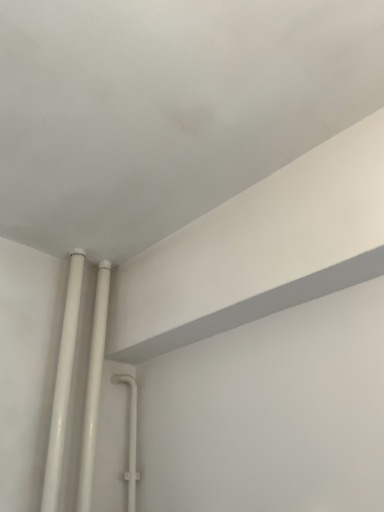
This screenshot has width=384, height=512. What do you see at coordinates (93, 387) in the screenshot?
I see `white glossy pipes at lower left, which ranks as the second pipe in left-to-right order` at bounding box center [93, 387].

Measure the distance between point (100, 380) and camera.

Point (100, 380) is 4.26 feet away from camera.

What is the approximate height of white glossy pipes at lower left, the first pipe when ordered from right to left?

It is 29.21 inches.

Identify the location of white glossy pipes at lower left, the first pipe when ordered from right to left. (93, 387).

How much space does white glossy pipes at lower left, the second pipe in the right-to-left sequence, occupy vertically?

The height of white glossy pipes at lower left, the second pipe in the right-to-left sequence, is 29.06 inches.

Describe the element at coordinates (63, 384) in the screenshot. I see `white glossy pipes at lower left, the second pipe in the right-to-left sequence` at that location.

At what (x,y) coordinates should I click in order to perform the action: click on white glossy pipes at lower left, the second pipe in the right-to-left sequence. Please return your answer as a coordinate pair (x, y). Looking at the image, I should click on (63, 384).

Identify the location of white glossy pipes at lower left, which ranks as the second pipe in left-to-right order. (93, 387).

Is white glossy pipes at lower left, arranged as the first pipe when viewed from the left, to the left of white glossy pipes at lower left, which ranks as the second pipe in left-to-right order, from the viewer's perspective?

Yes, white glossy pipes at lower left, arranged as the first pipe when viewed from the left, is to the left of white glossy pipes at lower left, which ranks as the second pipe in left-to-right order.

Considering their positions, is white glossy pipes at lower left, arranged as the first pipe when viewed from the left, located in front of or behind white glossy pipes at lower left, the first pipe when ordered from right to left?

In the image, white glossy pipes at lower left, arranged as the first pipe when viewed from the left, appears in front of white glossy pipes at lower left, the first pipe when ordered from right to left.

Which is farther from the camera, (76, 290) or (103, 271)?

Point (103, 271)

From the image's perspective, relative to white glossy pipes at lower left, the first pipe when ordered from right to left, is white glossy pipes at lower left, the second pipe in the right-to-left sequence, above or below?

From the image's perspective, white glossy pipes at lower left, the second pipe in the right-to-left sequence, appears above white glossy pipes at lower left, the first pipe when ordered from right to left.

From a real-world perspective, is white glossy pipes at lower left, the second pipe in the right-to-left sequence, positioned over white glossy pipes at lower left, the first pipe when ordered from right to left, based on gravity?

Indeed, from a real-world perspective, white glossy pipes at lower left, the second pipe in the right-to-left sequence, stands above white glossy pipes at lower left, the first pipe when ordered from right to left.

Which object is wider, white glossy pipes at lower left, the second pipe in the right-to-left sequence, or white glossy pipes at lower left, the first pipe when ordered from right to left?

With larger width is white glossy pipes at lower left, the first pipe when ordered from right to left.

Can you confirm if white glossy pipes at lower left, arranged as the first pipe when viewed from the left, is taller than white glossy pipes at lower left, which ranks as the second pipe in left-to-right order?

No, white glossy pipes at lower left, arranged as the first pipe when viewed from the left, is not taller than white glossy pipes at lower left, which ranks as the second pipe in left-to-right order.

In terms of size, does white glossy pipes at lower left, arranged as the first pipe when viewed from the left, appear bigger or smaller than white glossy pipes at lower left, the first pipe when ordered from right to left?

Clearly, white glossy pipes at lower left, arranged as the first pipe when viewed from the left, is smaller in size than white glossy pipes at lower left, the first pipe when ordered from right to left.

Is white glossy pipes at lower left, arranged as the first pipe when viewed from the left, completely or partially outside of white glossy pipes at lower left, the first pipe when ordered from right to left?

Yes.

Can you see white glossy pipes at lower left, the second pipe in the right-to-left sequence, touching white glossy pipes at lower left, which ranks as the second pipe in left-to-right order?

Yes, white glossy pipes at lower left, the second pipe in the right-to-left sequence, is with white glossy pipes at lower left, which ranks as the second pipe in left-to-right order.

Is white glossy pipes at lower left, arranged as the first pipe when viewed from the left, looking in the opposite direction of white glossy pipes at lower left, which ranks as the second pipe in left-to-right order?

white glossy pipes at lower left, arranged as the first pipe when viewed from the left, does not have its back to white glossy pipes at lower left, which ranks as the second pipe in left-to-right order.

Can you tell me how much white glossy pipes at lower left, the second pipe in the right-to-left sequence, and white glossy pipes at lower left, which ranks as the second pipe in left-to-right order, differ in facing direction?

The facing directions of white glossy pipes at lower left, the second pipe in the right-to-left sequence, and white glossy pipes at lower left, which ranks as the second pipe in left-to-right order, are 0.00526 degrees apart.

This screenshot has height=512, width=384. In the image, there is a white glossy pipes at lower left, arranged as the first pipe when viewed from the left. What are the coordinates of `pipe below it (from the image's perspective)` in the screenshot? It's located at (93, 387).

Is white glossy pipes at lower left, which ranks as the second pipe in left-to-right order, at the left side of white glossy pipes at lower left, arranged as the first pipe when viewed from the left?

Incorrect, white glossy pipes at lower left, which ranks as the second pipe in left-to-right order, is not on the left side of white glossy pipes at lower left, arranged as the first pipe when viewed from the left.

Is white glossy pipes at lower left, the first pipe when ordered from right to left, in front of or behind white glossy pipes at lower left, the second pipe in the right-to-left sequence, in the image?

Visually, white glossy pipes at lower left, the first pipe when ordered from right to left, is located behind white glossy pipes at lower left, the second pipe in the right-to-left sequence.

Does point (106, 318) come closer to viewer compared to point (55, 445)?

No.

From the image's perspective, who appears lower, white glossy pipes at lower left, the first pipe when ordered from right to left, or white glossy pipes at lower left, the second pipe in the right-to-left sequence?

white glossy pipes at lower left, the first pipe when ordered from right to left, appears lower in the image.

From a real-world perspective, is white glossy pipes at lower left, the first pipe when ordered from right to left, positioned under white glossy pipes at lower left, the second pipe in the right-to-left sequence, based on gravity?

Yes.

Does white glossy pipes at lower left, the first pipe when ordered from right to left, have a greater width compared to white glossy pipes at lower left, arranged as the first pipe when viewed from the left?

Indeed, white glossy pipes at lower left, the first pipe when ordered from right to left, has a greater width compared to white glossy pipes at lower left, arranged as the first pipe when viewed from the left.

Who is taller, white glossy pipes at lower left, the first pipe when ordered from right to left, or white glossy pipes at lower left, arranged as the first pipe when viewed from the left?

white glossy pipes at lower left, the first pipe when ordered from right to left, is taller.

Looking at the image, does white glossy pipes at lower left, which ranks as the second pipe in left-to-right order, seem bigger or smaller compared to white glossy pipes at lower left, the second pipe in the right-to-left sequence?

Considering their sizes, white glossy pipes at lower left, which ranks as the second pipe in left-to-right order, takes up more space than white glossy pipes at lower left, the second pipe in the right-to-left sequence.

Is white glossy pipes at lower left, which ranks as the second pipe in left-to-right order, inside or outside of white glossy pipes at lower left, arranged as the first pipe when viewed from the left?

white glossy pipes at lower left, which ranks as the second pipe in left-to-right order, is located beyond the bounds of white glossy pipes at lower left, arranged as the first pipe when viewed from the left.

Is white glossy pipes at lower left, which ranks as the second pipe in left-to-right order, touching white glossy pipes at lower left, the second pipe in the right-to-left sequence?

Yes, white glossy pipes at lower left, which ranks as the second pipe in left-to-right order, is beside white glossy pipes at lower left, the second pipe in the right-to-left sequence.

Does white glossy pipes at lower left, the first pipe when ordered from right to left, turn towards white glossy pipes at lower left, the second pipe in the right-to-left sequence?

No, white glossy pipes at lower left, the first pipe when ordered from right to left, is not turned towards white glossy pipes at lower left, the second pipe in the right-to-left sequence.

How far apart are white glossy pipes at lower left, which ranks as the second pipe in left-to-right order, and white glossy pipes at lower left, the second pipe in the right-to-left sequence?

The distance of white glossy pipes at lower left, which ranks as the second pipe in left-to-right order, from white glossy pipes at lower left, the second pipe in the right-to-left sequence, is 9.03 centimeters.

Find the location of a particular element. The height and width of the screenshot is (512, 384). pipe behind the white glossy pipes at lower left, arranged as the first pipe when viewed from the left is located at coordinates (93, 387).

Locate an element on the screen. This screenshot has width=384, height=512. pipe that is below the white glossy pipes at lower left, the second pipe in the right-to-left sequence (from the image's perspective) is located at coordinates (93, 387).

At what (x,y) coordinates should I click in order to perform the action: click on pipe that appears on the left of white glossy pipes at lower left, the first pipe when ordered from right to left. Please return your answer as a coordinate pair (x, y). This screenshot has height=512, width=384. Looking at the image, I should click on (63, 384).